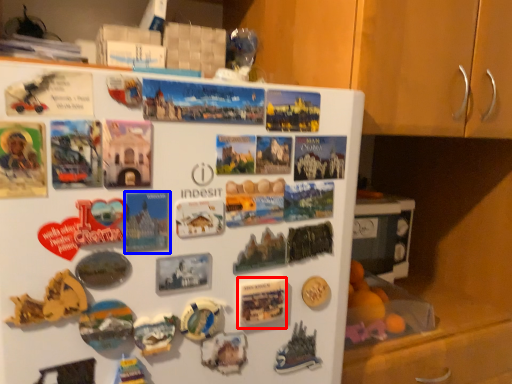
Question: Which of the following is the closest to the observer, postcard (highlighted by a red box) or postcard (highlighted by a blue box)?

Choices:
 (A) postcard
 (B) postcard

Answer: (B)